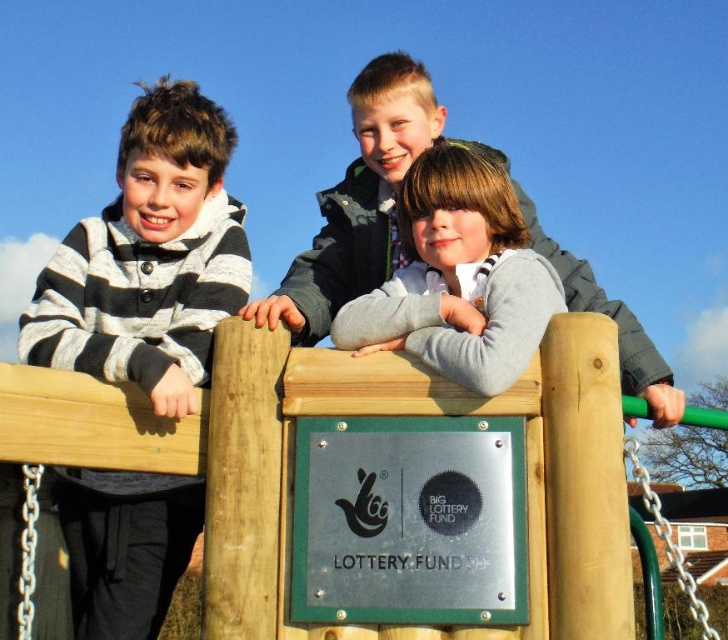
Can you confirm if gray matte sweater at center is taller than gray fleece jacket at center?

Incorrect, gray matte sweater at center's height is not larger of gray fleece jacket at center's.

Can you confirm if gray matte sweater at center is positioned above gray fleece jacket at center?

No.

Who is more distant from viewer, (478, 170) or (344, 273)?

Positioned behind is point (344, 273).

Where is `gray matte sweater at center`? gray matte sweater at center is located at coordinates (458, 276).

Who is more distant from viewer, (189, 122) or (364, 157)?

The point (364, 157) is more distant.

Between striped knit sweater at left and gray fleece jacket at center, which one appears on the left side from the viewer's perspective?

striped knit sweater at left

The height and width of the screenshot is (640, 728). Describe the element at coordinates (149, 259) in the screenshot. I see `striped knit sweater at left` at that location.

You are a GUI agent. You are given a task and a screenshot of the screen. Output one action in this format:
    pyautogui.click(x=<x>, y=<y>)
    Task: Click on the striped knit sweater at left
    
    Given the screenshot: What is the action you would take?
    pyautogui.click(x=149, y=259)

Is point (157, 616) positioned after point (395, 310)?

Yes, it is behind point (395, 310).

Who is shorter, striped knit sweater at left or gray matte sweater at center?

Standing shorter between the two is gray matte sweater at center.

Is point (189, 202) closer to camera compared to point (432, 273)?

That is False.

Locate an element on the screen. The height and width of the screenshot is (640, 728). striped knit sweater at left is located at coordinates (149, 259).